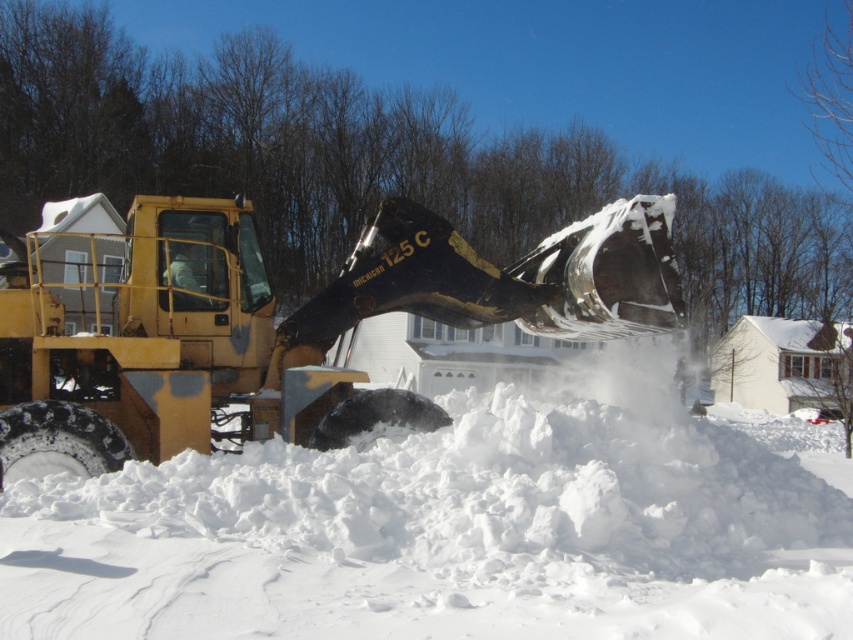
You are a snowplow operator who needs to clear the road. You see the white fluffy snow at center and the yellow metallic tractor at left. Which one is lower in height?

The white fluffy snow at center has a lesser height compared to the yellow metallic tractor at left, so the white fluffy snow at center is lower.